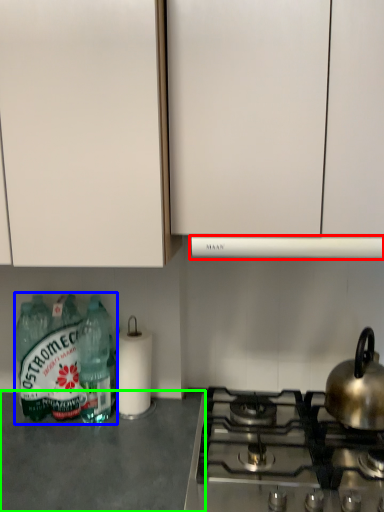
Question: Considering the real-world distances, which object is closest to vent (highlighted by a red box)? bottle (highlighted by a blue box) or counter top (highlighted by a green box).

Choices:
 (A) bottle
 (B) counter top

Answer: (A)